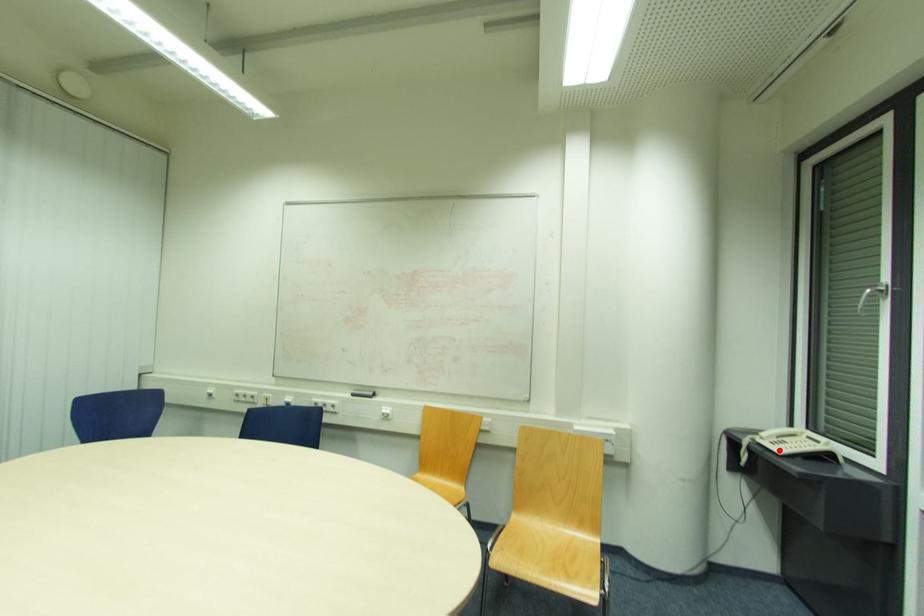
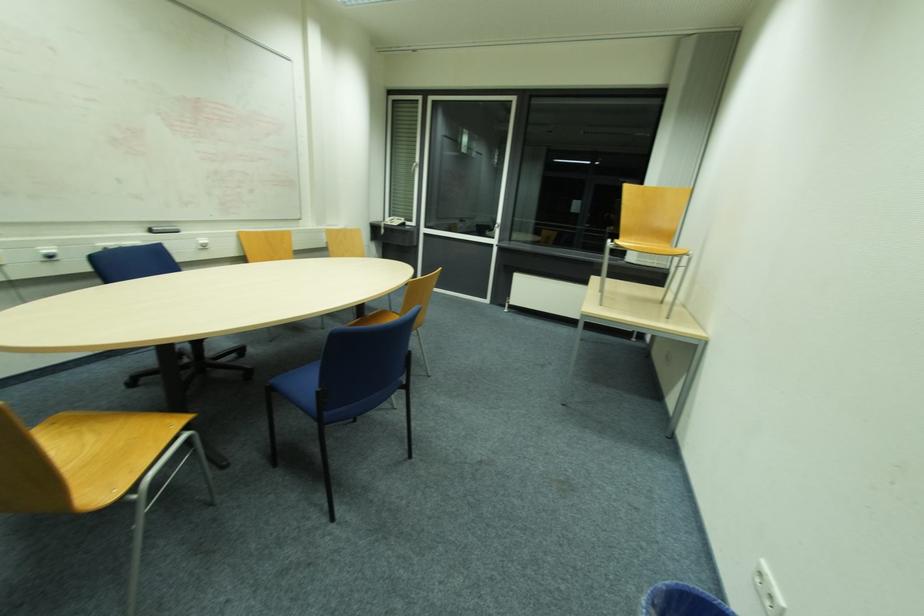
Question: I am providing you with two images of the same scene from different viewpoints. Given a red point in image1, look at the same physical point in image2. Is it:

Choices:
 (A) Closer to the viewpoint
 (B) Farther from the viewpoint

Answer: (A)